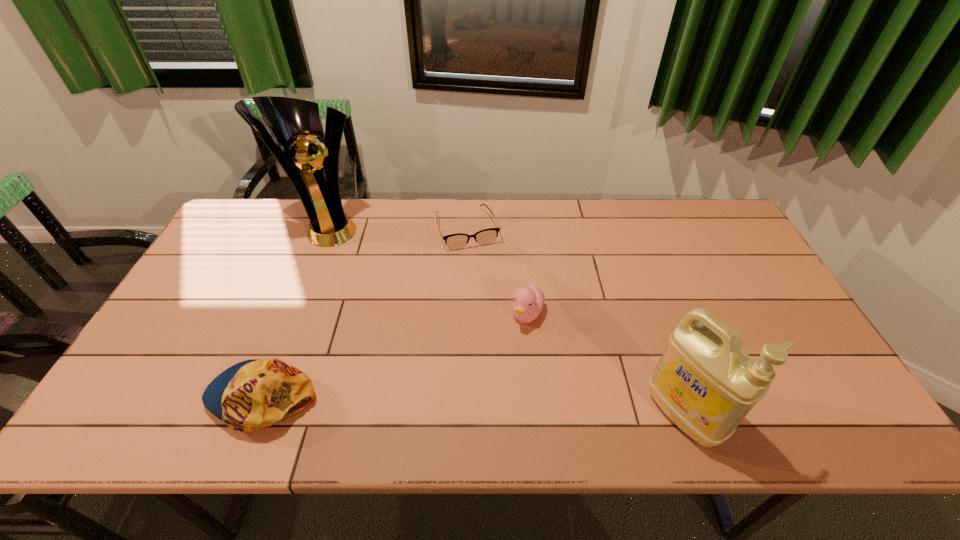
Where is `free area in between the award and the cap`? free area in between the award and the cap is located at coordinates (296, 312).

I want to click on empty space between the third object from left to right and the tallest object, so click(398, 228).

At what (x,y) coordinates should I click in order to perform the action: click on empty space that is in between the second tallest object and the award. Please return your answer as a coordinate pair (x, y). The image size is (960, 540). Looking at the image, I should click on (507, 320).

Identify the location of free space between the cap and the shortest object. Image resolution: width=960 pixels, height=540 pixels. (366, 313).

What are the coordinates of `free point between the tallest object and the rightmost object` in the screenshot? It's located at (507, 320).

You are a GUI agent. You are given a task and a screenshot of the screen. Output one action in this format:
    pyautogui.click(x=<x>, y=<y>)
    Task: Click on the vacant area that lies between the award and the third farthest object
    This screenshot has width=960, height=540.
    Given the screenshot: What is the action you would take?
    pyautogui.click(x=428, y=271)

Find the location of a particular element. Image resolution: width=960 pixels, height=540 pixels. vacant space that is in between the cap and the tallest object is located at coordinates (296, 312).

Where is `empty space that is in between the spectacles and the second tallest object`? Image resolution: width=960 pixels, height=540 pixels. empty space that is in between the spectacles and the second tallest object is located at coordinates (576, 322).

This screenshot has height=540, width=960. I want to click on vacant space in between the second tallest object and the fourth object from left to right, so click(x=606, y=364).

You are a GUI agent. You are given a task and a screenshot of the screen. Output one action in this format:
    pyautogui.click(x=<x>, y=<y>)
    Task: Click on the empty space between the detergent and the tallest object
    
    Given the screenshot: What is the action you would take?
    pyautogui.click(x=507, y=320)